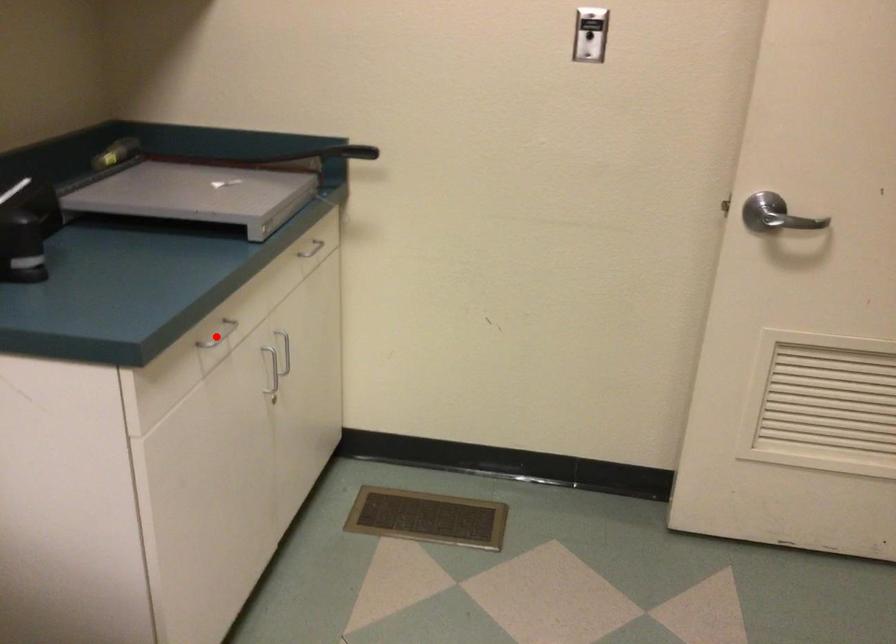
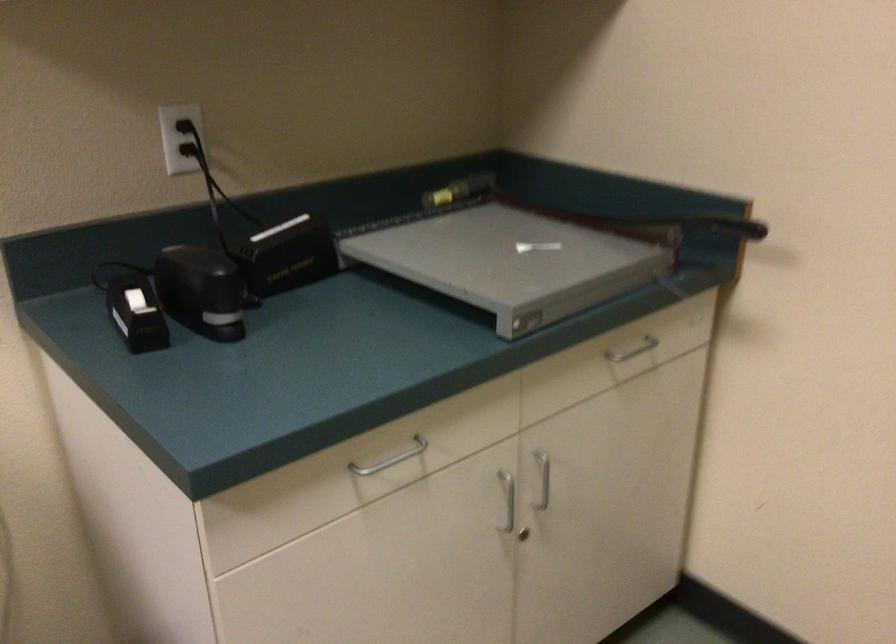
Question: I am providing you with two images of the same scene from different viewpoints. Given a red point in image1, look at the same physical point in image2. Is it:

Choices:
 (A) Closer to the viewpoint
 (B) Farther from the viewpoint

Answer: (A)